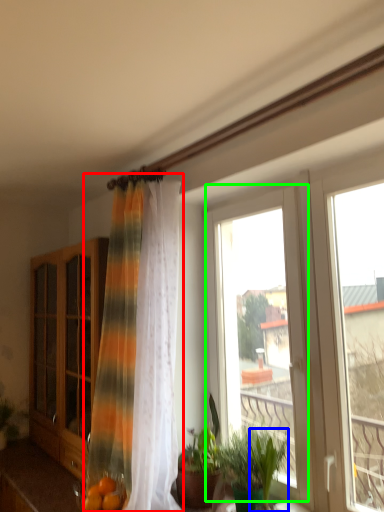
Question: Estimate the real-world distances between objects in this image. Which object is farther from curtain (highlighted by a red box), plant (highlighted by a blue box) or window (highlighted by a green box)?

Choices:
 (A) plant
 (B) window

Answer: (A)